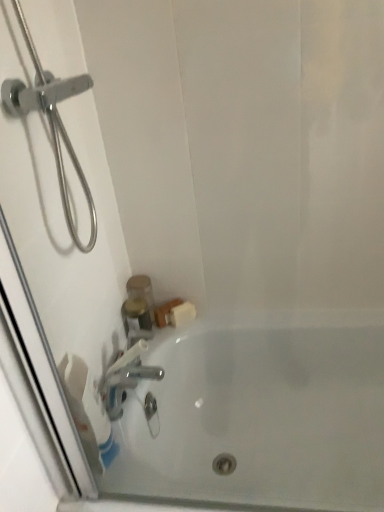
Question: Considering the relative positions of white glossy bathtub at lower center and white matte toilet paper at lower left in the image provided, is white glossy bathtub at lower center in front of white matte toilet paper at lower left?

Choices:
 (A) yes
 (B) no

Answer: (A)

Question: Is white glossy bathtub at lower center touching white matte toilet paper at lower left?

Choices:
 (A) yes
 (B) no

Answer: (B)

Question: Considering the relative sizes of white glossy bathtub at lower center and white matte toilet paper at lower left in the image provided, is white glossy bathtub at lower center thinner than white matte toilet paper at lower left?

Choices:
 (A) no
 (B) yes

Answer: (A)

Question: Would you say white glossy bathtub at lower center is outside white matte toilet paper at lower left?

Choices:
 (A) yes
 (B) no

Answer: (A)

Question: From the image's perspective, would you say white glossy bathtub at lower center is shown under white matte toilet paper at lower left?

Choices:
 (A) no
 (B) yes

Answer: (B)

Question: Is white glossy bathtub at lower center far away from white matte toilet paper at lower left?

Choices:
 (A) no
 (B) yes

Answer: (A)

Question: Is translucent plastic container at upper left smaller than white glossy bathtub at lower center?

Choices:
 (A) yes
 (B) no

Answer: (A)

Question: Is translucent plastic container at upper left bigger than white glossy bathtub at lower center?

Choices:
 (A) yes
 (B) no

Answer: (B)

Question: Considering the relative sizes of translucent plastic container at upper left and white glossy bathtub at lower center in the image provided, is translucent plastic container at upper left thinner than white glossy bathtub at lower center?

Choices:
 (A) yes
 (B) no

Answer: (A)

Question: Is translucent plastic container at upper left facing away from white glossy bathtub at lower center?

Choices:
 (A) yes
 (B) no

Answer: (B)

Question: Is translucent plastic container at upper left oriented towards white glossy bathtub at lower center?

Choices:
 (A) yes
 (B) no

Answer: (B)

Question: Can you confirm if translucent plastic container at upper left is wider than white glossy bathtub at lower center?

Choices:
 (A) yes
 (B) no

Answer: (B)

Question: From a real-world perspective, is white matte toilet paper at lower left on translucent plastic container at upper left?

Choices:
 (A) no
 (B) yes

Answer: (B)